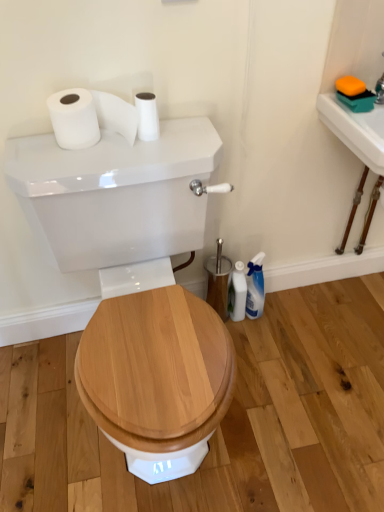
At what (x,y) coordinates should I click in order to perform the action: click on free spot in front of white matte toilet paper at upper left, which appears as the first toilet paper when viewed from the left. Please return your answer as a coordinate pair (x, y). This screenshot has width=384, height=512. Looking at the image, I should click on (85, 162).